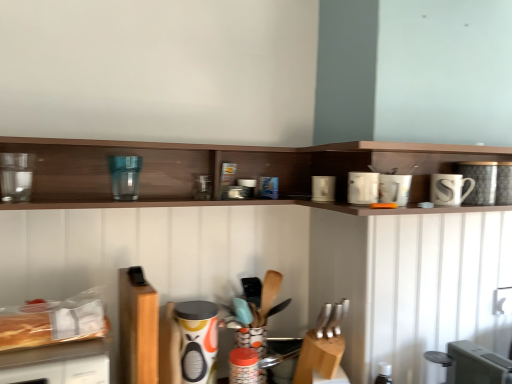
Question: Is white ceramic mug at upper right, the 8th appliance positioned from the left, positioned beyond the bounds of silver metallic knives at center, which appears as the 1th silverware when viewed from the front?

Choices:
 (A) no
 (B) yes

Answer: (B)

Question: Does white ceramic mug at upper right, the third appliance in the right-to-left sequence, have a larger size compared to silver metallic knives at center, which appears as the 1th silverware when viewed from the front?

Choices:
 (A) no
 (B) yes

Answer: (B)

Question: Does white ceramic mug at upper right, the 8th appliance positioned from the left, have a greater width compared to silver metallic knives at center, the 1th silverware viewed from the right?

Choices:
 (A) no
 (B) yes

Answer: (B)

Question: Is white ceramic mug at upper right, the 8th appliance positioned from the left, with silver metallic knives at center, which is the 2th silverware from back to front?

Choices:
 (A) no
 (B) yes

Answer: (A)

Question: Does white ceramic mug at upper right, the 8th appliance positioned from the left, turn towards silver metallic knives at center, which is the 2th silverware from back to front?

Choices:
 (A) yes
 (B) no

Answer: (B)

Question: Looking at their shapes, would you say metallic silver toaster at upper center, the 6th appliance when ordered from right to left, is wider or thinner than white glossy toaster at upper right, arranged as the sixth appliance when viewed from the left?

Choices:
 (A) thin
 (B) wide

Answer: (A)

Question: Relative to white glossy toaster at upper right, marked as the 5th appliance in a right-to-left arrangement, is metallic silver toaster at upper center, which appears as the fifth appliance when viewed from the left, in front or behind?

Choices:
 (A) front
 (B) behind

Answer: (B)

Question: Is metallic silver toaster at upper center, the 6th appliance when ordered from right to left, bigger or smaller than white glossy toaster at upper right, marked as the 5th appliance in a right-to-left arrangement?

Choices:
 (A) big
 (B) small

Answer: (B)

Question: Considering the positions of metallic silver toaster at upper center, the 6th appliance when ordered from right to left, and white glossy toaster at upper right, arranged as the sixth appliance when viewed from the left, in the image, is metallic silver toaster at upper center, the 6th appliance when ordered from right to left, taller or shorter than white glossy toaster at upper right, arranged as the sixth appliance when viewed from the left,?

Choices:
 (A) tall
 (B) short

Answer: (B)

Question: Is white glossy coffee cup at upper right, the seventh appliance from the left, wider or thinner than metallic silver toaster at center, which is the 7th appliance in right-to-left order?

Choices:
 (A) wide
 (B) thin

Answer: (A)

Question: From a real-world perspective, relative to metallic silver toaster at center, which ranks as the 4th appliance in left-to-right order, is white glossy coffee cup at upper right, which is the fourth appliance in right-to-left order, vertically above or below?

Choices:
 (A) above
 (B) below

Answer: (B)

Question: In terms of height, does white glossy coffee cup at upper right, which is the fourth appliance in right-to-left order, look taller or shorter compared to metallic silver toaster at center, which ranks as the 4th appliance in left-to-right order?

Choices:
 (A) short
 (B) tall

Answer: (B)

Question: Considering the positions of white glossy coffee cup at upper right, which is the fourth appliance in right-to-left order, and metallic silver toaster at center, which is the 7th appliance in right-to-left order, in the image, is white glossy coffee cup at upper right, which is the fourth appliance in right-to-left order, bigger or smaller than metallic silver toaster at center, which is the 7th appliance in right-to-left order,?

Choices:
 (A) big
 (B) small

Answer: (A)

Question: From the image's perspective, is white glossy coffee cup at upper right, which is the fourth appliance in right-to-left order, positioned above or below wooden spoon at center, which is counted as the 2th silverware, starting from the right?

Choices:
 (A) above
 (B) below

Answer: (A)

Question: Is white glossy coffee cup at upper right, which is the fourth appliance in right-to-left order, situated inside wooden spoon at center, the 2th silverware viewed from the front, or outside?

Choices:
 (A) inside
 (B) outside

Answer: (B)